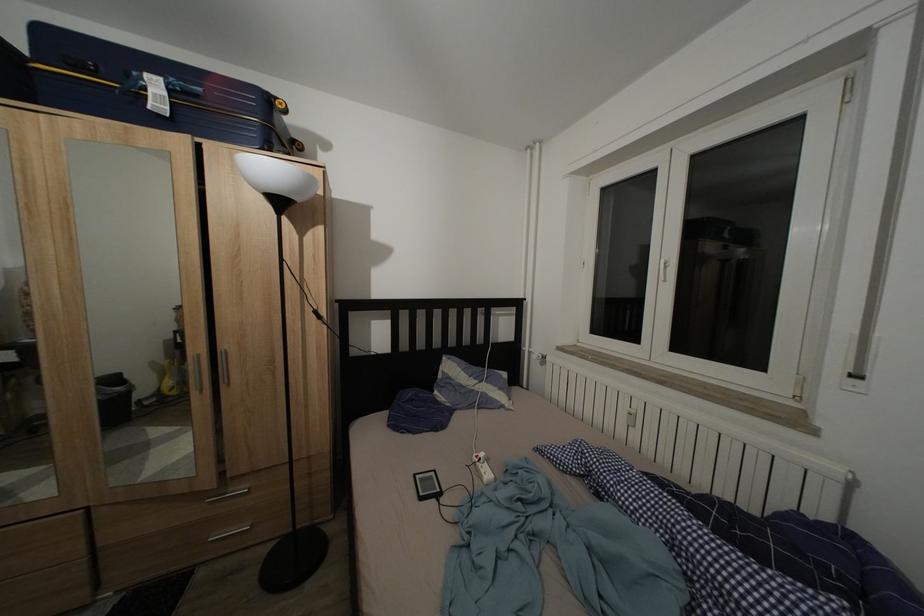
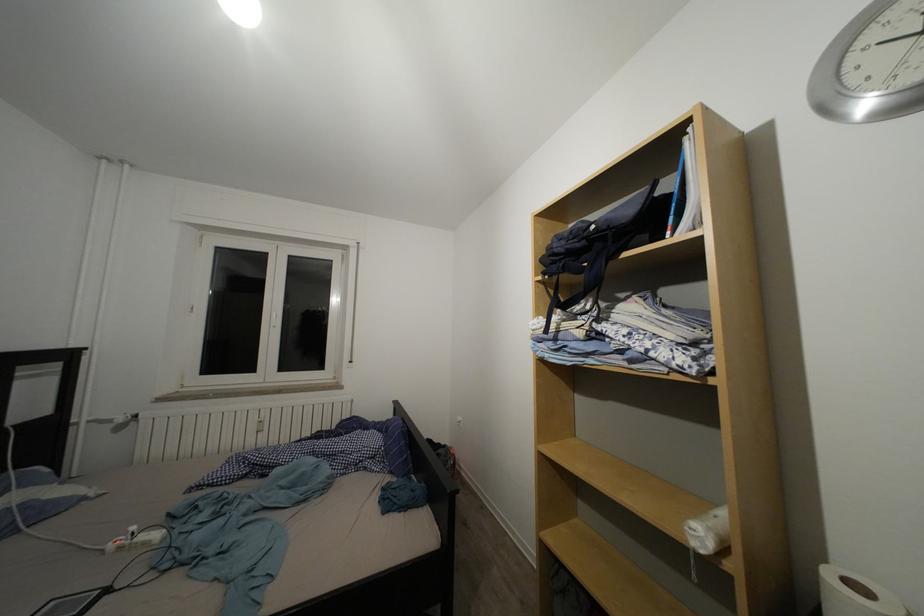
In the second image, find the point that corresponds to pixel 441 480 in the first image.

(61, 610)